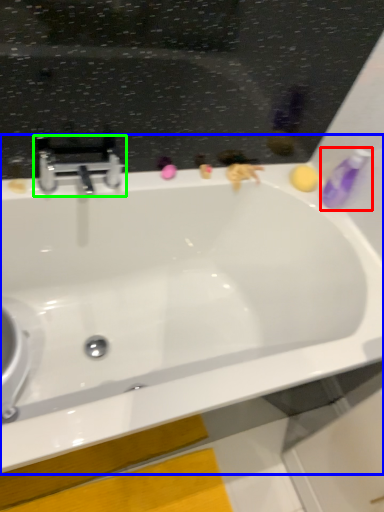
Question: Which is farther away from toiletry (highlighted by a red box)? bathtub (highlighted by a blue box) or tap (highlighted by a green box)?

Choices:
 (A) bathtub
 (B) tap

Answer: (B)